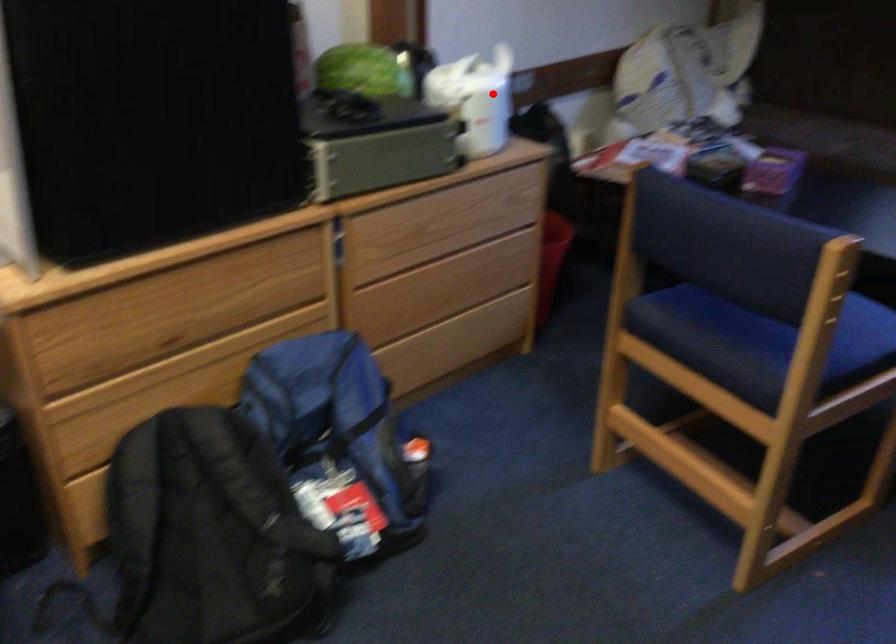
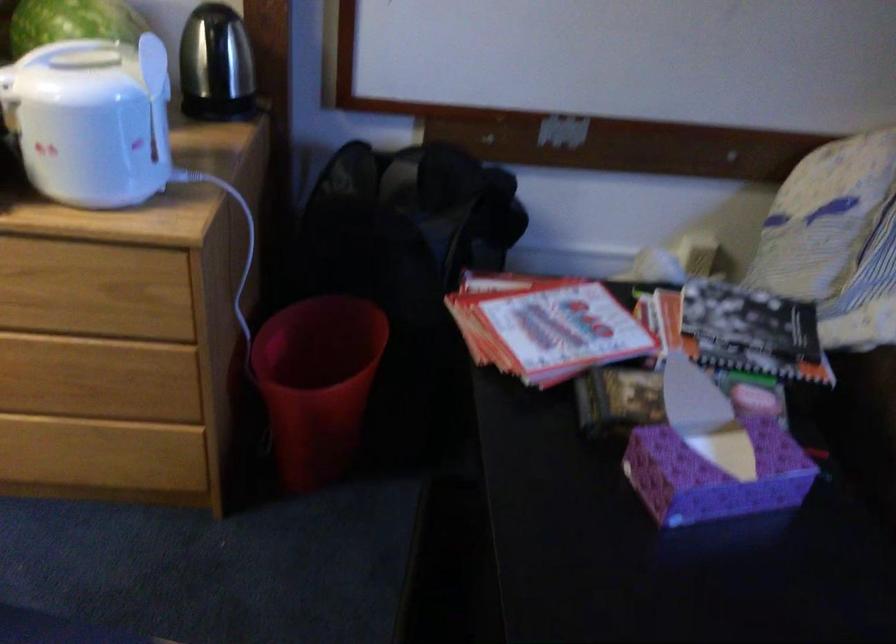
Question: I am providing you with two images of the same scene from different viewpoints. Given a red point in image1, look at the same physical point in image2. Is it:

Choices:
 (A) Closer to the viewpoint
 (B) Farther from the viewpoint

Answer: (A)